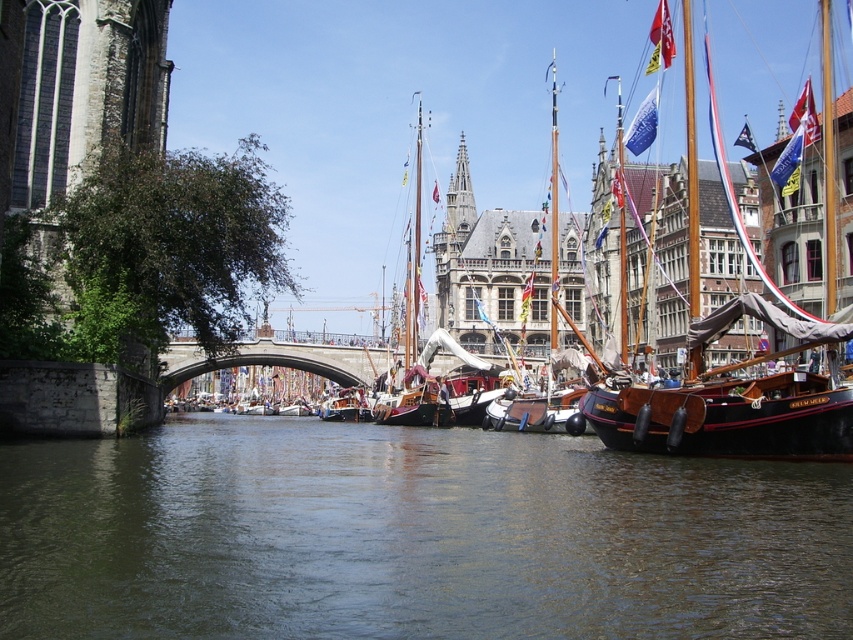
What do you see at coordinates (737, 397) in the screenshot? This screenshot has width=853, height=640. I see `wooden sailboat at right` at bounding box center [737, 397].

This screenshot has width=853, height=640. What do you see at coordinates (737, 397) in the screenshot? I see `wooden sailboat at right` at bounding box center [737, 397].

Identify the location of wooden sailboat at right. (737, 397).

Can you confirm if dark green water at center is taller than wooden sailboat at right?

No.

Does dark green water at center appear on the left side of wooden sailboat at right?

Indeed, dark green water at center is positioned on the left side of wooden sailboat at right.

Where is `dark green water at center`? Image resolution: width=853 pixels, height=640 pixels. dark green water at center is located at coordinates (412, 536).

The image size is (853, 640). Find the location of `dark green water at center`. dark green water at center is located at coordinates (412, 536).

Does dark green water at center have a greater height compared to wooden sailboat at center?

In fact, dark green water at center may be shorter than wooden sailboat at center.

Who is higher up, dark green water at center or wooden sailboat at center?

wooden sailboat at center is higher up.

Describe the element at coordinates (412, 536) in the screenshot. I see `dark green water at center` at that location.

This screenshot has width=853, height=640. I want to click on dark green water at center, so click(412, 536).